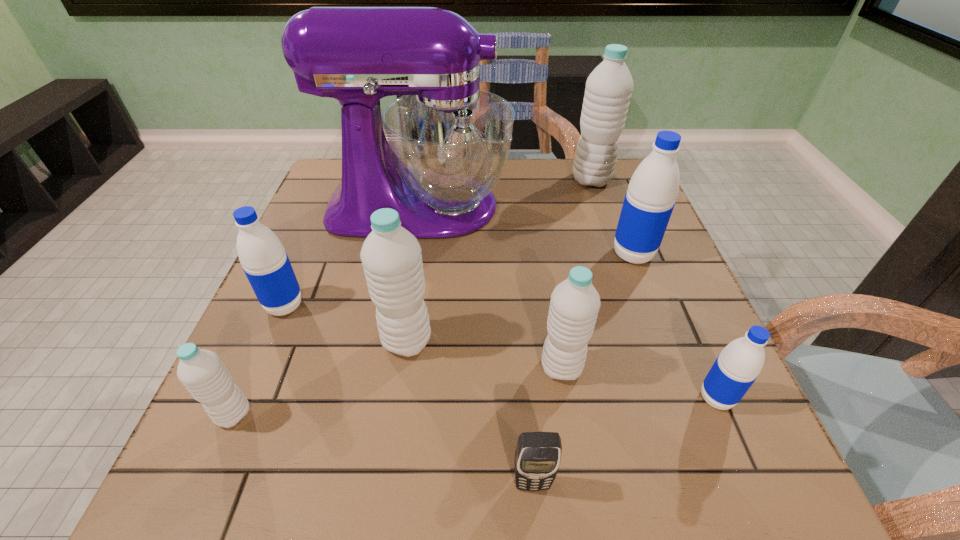
This screenshot has width=960, height=540. I want to click on purple mixer, so click(447, 143).

The width and height of the screenshot is (960, 540). What are the coordinates of `the tallest object` in the screenshot? It's located at (447, 143).

The width and height of the screenshot is (960, 540). In order to click on the rightmost white water bottle in this screenshot , I will do `click(608, 90)`.

At what (x,y) coordinates should I click in order to perform the action: click on the farthest white water bottle. Please return your answer as a coordinate pair (x, y). This screenshot has height=540, width=960. Looking at the image, I should click on click(x=608, y=90).

Locate an element on the screen. the farthest blue water bottle is located at coordinates (649, 201).

I want to click on the biggest blue water bottle, so click(x=649, y=201).

Locate an element on the screen. The image size is (960, 540). the third water bottle from left to right is located at coordinates (391, 256).

Image resolution: width=960 pixels, height=540 pixels. In order to click on the third smallest white water bottle in this screenshot , I will do `click(391, 256)`.

Locate an element on the screen. This screenshot has width=960, height=540. the fourth water bottle from right to left is located at coordinates (574, 305).

What are the coordinates of `the second smallest white water bottle` in the screenshot? It's located at (574, 305).